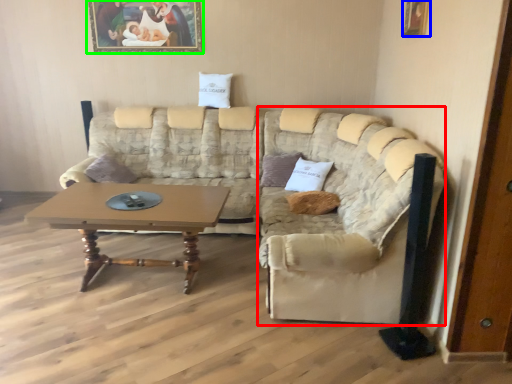
Question: Which is nearer to the beige (highlighted by a red box)? picture frame (highlighted by a blue box) or picture frame (highlighted by a green box).

Choices:
 (A) picture frame
 (B) picture frame

Answer: (A)